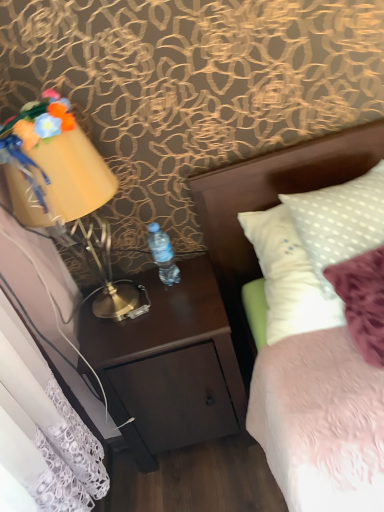
Question: Considering the relative sizes of matte yellow lampshade at left and white fabric headboard at upper right in the image provided, is matte yellow lampshade at left shorter than white fabric headboard at upper right?

Choices:
 (A) no
 (B) yes

Answer: (A)

Question: Is matte yellow lampshade at left aimed at white fabric headboard at upper right?

Choices:
 (A) yes
 (B) no

Answer: (B)

Question: From a real-world perspective, is matte yellow lampshade at left physically below white fabric headboard at upper right?

Choices:
 (A) yes
 (B) no

Answer: (B)

Question: From a real-world perspective, is matte yellow lampshade at left on white fabric headboard at upper right?

Choices:
 (A) no
 (B) yes

Answer: (B)

Question: Is matte yellow lampshade at left located outside white fabric headboard at upper right?

Choices:
 (A) no
 (B) yes

Answer: (B)

Question: From the image's perspective, does matte yellow lampshade at left appear higher than white fabric headboard at upper right?

Choices:
 (A) no
 (B) yes

Answer: (A)

Question: Is dark wood nightstand at center located outside white fabric headboard at upper right?

Choices:
 (A) no
 (B) yes

Answer: (B)

Question: Is dark wood nightstand at center shorter than white fabric headboard at upper right?

Choices:
 (A) no
 (B) yes

Answer: (A)

Question: From the image's perspective, does dark wood nightstand at center appear lower than white fabric headboard at upper right?

Choices:
 (A) no
 (B) yes

Answer: (B)

Question: Can you confirm if dark wood nightstand at center is thinner than white fabric headboard at upper right?

Choices:
 (A) yes
 (B) no

Answer: (B)

Question: Is dark wood nightstand at center looking in the opposite direction of white fabric headboard at upper right?

Choices:
 (A) no
 (B) yes

Answer: (A)

Question: Considering the relative positions of dark wood nightstand at center and white fabric headboard at upper right in the image provided, is dark wood nightstand at center to the right of white fabric headboard at upper right from the viewer's perspective?

Choices:
 (A) no
 (B) yes

Answer: (A)

Question: Is matte yellow lampshade at left smaller than dark wood nightstand at center?

Choices:
 (A) yes
 (B) no

Answer: (A)